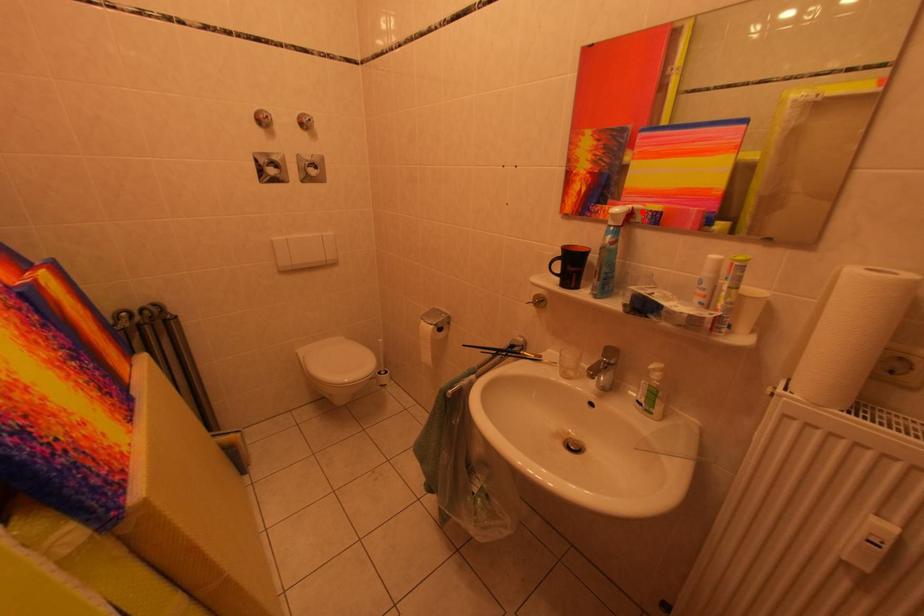
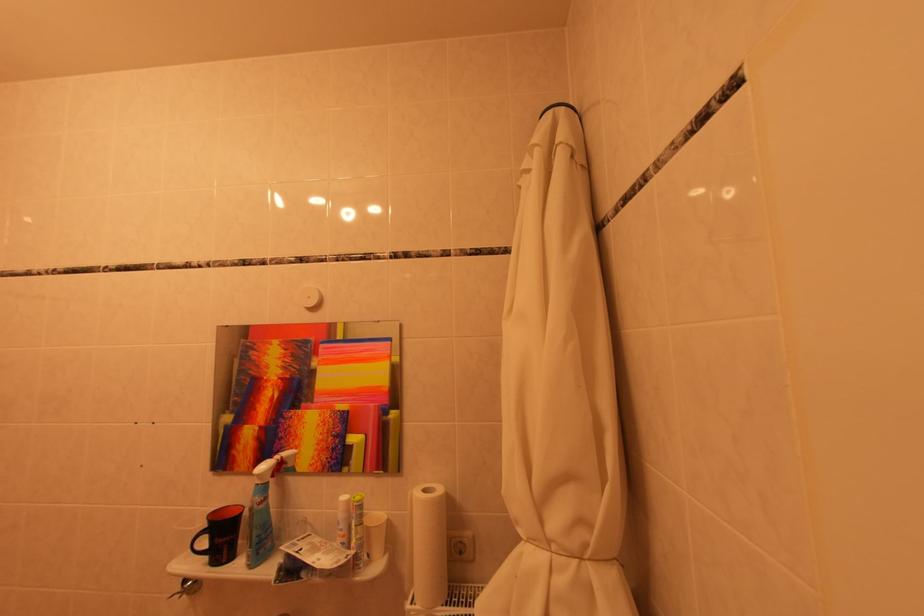
The point at the highlighted location is marked in the first image. Where is the corresponding point in the second image?

(290, 461)